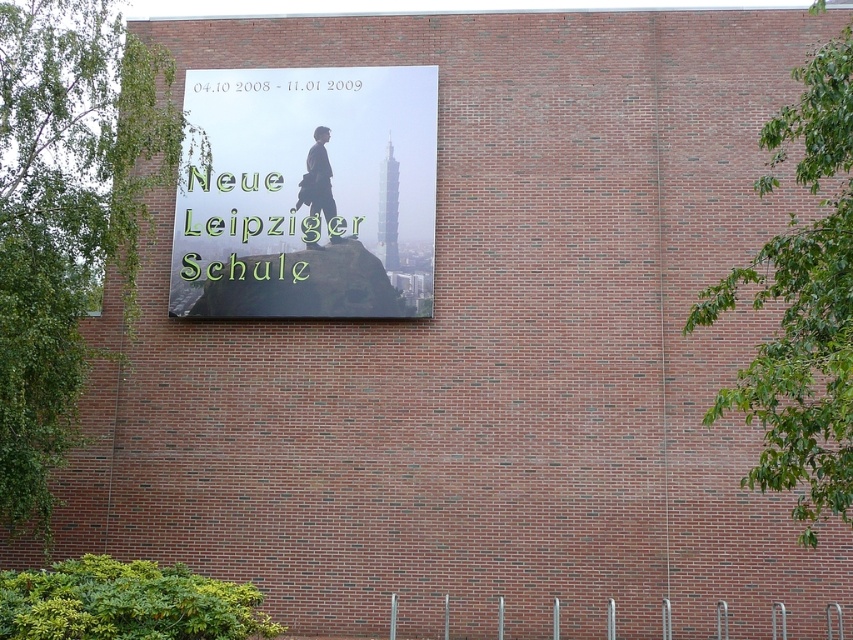
You are standing in front of the brick wall and want to place a small sticker exactly between the matte glass sign at center and the matte black suit at center. Which object should you use as a reference point to ensure the sticker is centered?

The matte glass sign at center is positioned on the left side of the matte black suit at center. To center the sticker between them, use the midpoint between the two objects as the reference point.

You are standing in front of the brick wall and want to locate the matte glass sign at center. According to the coordinates provided, where exactly should you look to find it?

The matte glass sign at center is located at coordinates point (308, 195).